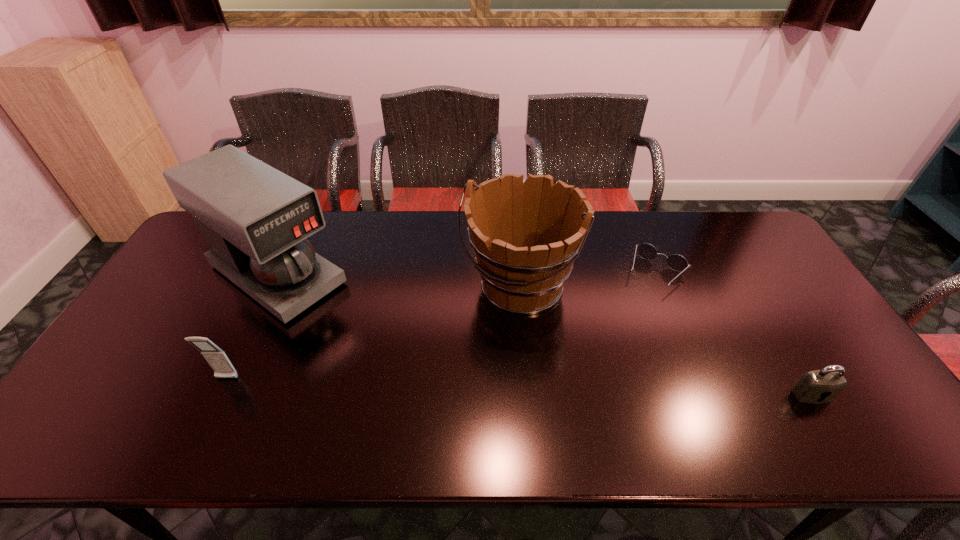
At what (x,y) coordinates should I click in order to perform the action: click on vacant space located on the carafe side of the coffee maker. Please return your answer as a coordinate pair (x, y). This screenshot has width=960, height=540. Looking at the image, I should click on (362, 332).

Identify the location of vacant space located on the carafe side of the coffee maker. (409, 365).

Find the location of `free location located on the front-facing side of the spectacles`. free location located on the front-facing side of the spectacles is located at coordinates (622, 331).

Locate an element on the screen. vacant space located on the front-facing side of the spectacles is located at coordinates (612, 348).

Where is `vacant region located on the front-facing side of the spectacles`? This screenshot has height=540, width=960. vacant region located on the front-facing side of the spectacles is located at coordinates (639, 300).

Image resolution: width=960 pixels, height=540 pixels. In order to click on vacant area situated with the handle on the wine bucket in this screenshot , I will do `click(473, 355)`.

Find the location of `vacant region located 0.230m with the handle on the wine bucket`. vacant region located 0.230m with the handle on the wine bucket is located at coordinates (453, 388).

Image resolution: width=960 pixels, height=540 pixels. What are the coordinates of `vacant space positioned with the handle on the wine bucket` in the screenshot? It's located at [x=484, y=339].

Image resolution: width=960 pixels, height=540 pixels. I want to click on coffee maker situated at the far edge, so click(x=255, y=219).

Identify the location of spectacles located at the far edge. This screenshot has height=540, width=960. (676, 262).